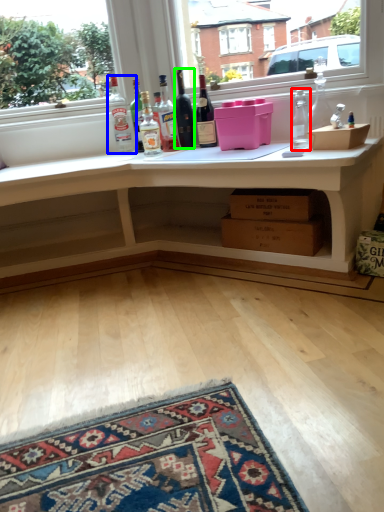
Question: Which object is the closest to the bottle (highlighted by a red box)? Choose among these: bottle (highlighted by a blue box) or bottle (highlighted by a green box).

Choices:
 (A) bottle
 (B) bottle

Answer: (B)